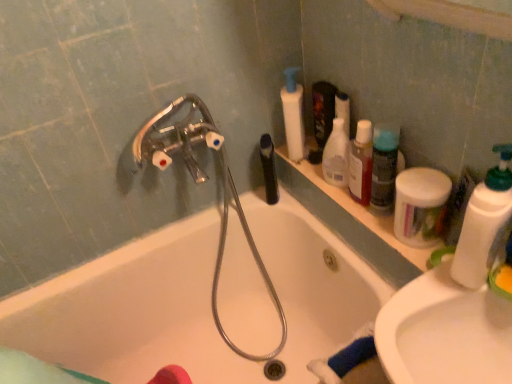
Find the location of `free space in front of white plastic pump bottle at upper center, which is the 5th cleaning product in front-to-back order`. free space in front of white plastic pump bottle at upper center, which is the 5th cleaning product in front-to-back order is located at coordinates (308, 168).